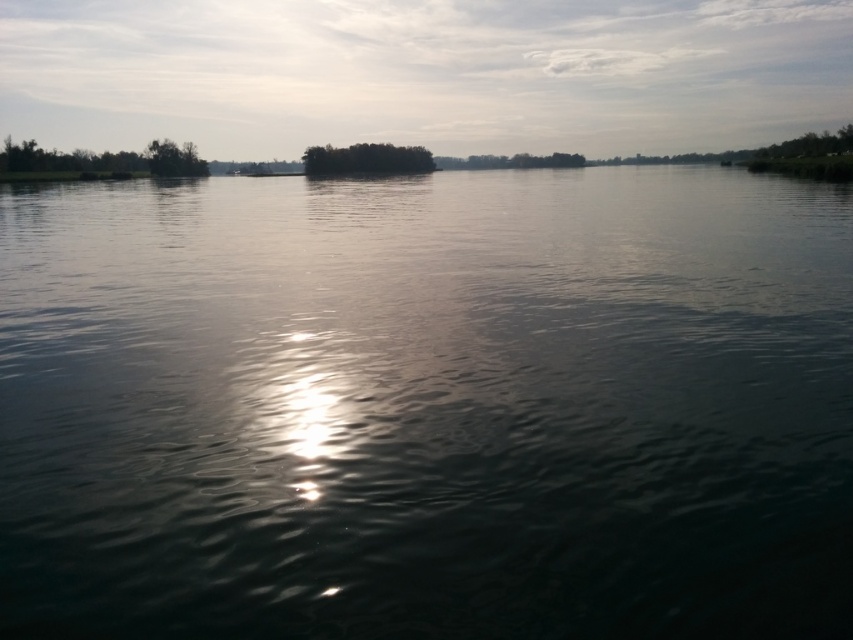
Question: Is the position of greenish reflective water at center more distant than that of green leafy island at center?

Choices:
 (A) no
 (B) yes

Answer: (A)

Question: Which point is farther from the camera taking this photo?

Choices:
 (A) (196, 154)
 (B) (318, 166)
 (C) (28, 145)

Answer: (B)

Question: Does green leafy trees at left have a larger size compared to green matte tree at upper left?

Choices:
 (A) no
 (B) yes

Answer: (B)

Question: Which point appears closest to the camera in this image?

Choices:
 (A) tap(3, 253)
 (B) tap(183, 170)

Answer: (A)

Question: Is green leafy trees at left smaller than green matte tree at upper left?

Choices:
 (A) no
 (B) yes

Answer: (A)

Question: Which point appears closest to the camera in this image?

Choices:
 (A) [x=173, y=156]
 (B) [x=207, y=166]
 (C) [x=793, y=460]

Answer: (C)